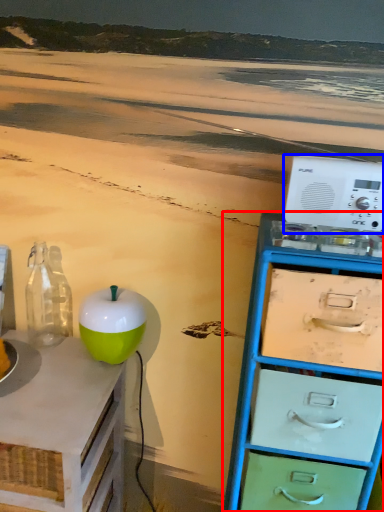
Question: Which of the following is the farthest to the observer, chest of drawers (highlighted by a red box) or appliance (highlighted by a blue box)?

Choices:
 (A) chest of drawers
 (B) appliance

Answer: (B)